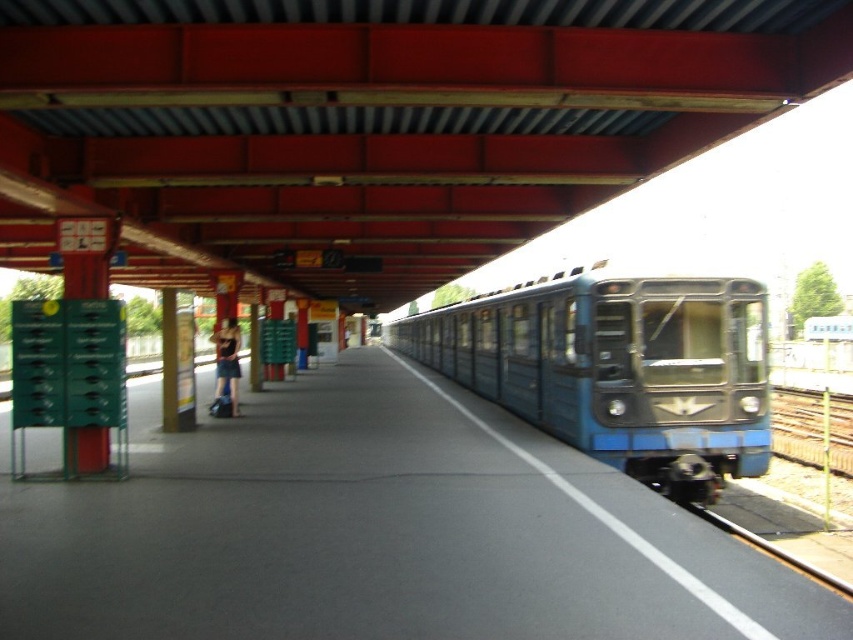
Can you confirm if blue metallic train at center is bigger than matte black dress at left?

No.

Does blue metallic train at center have a greater width compared to matte black dress at left?

Incorrect, blue metallic train at center's width does not surpass matte black dress at left's.

Is point (726, 364) behind point (234, 340)?

That is False.

Locate an element on the screen. blue metallic train at center is located at coordinates (618, 369).